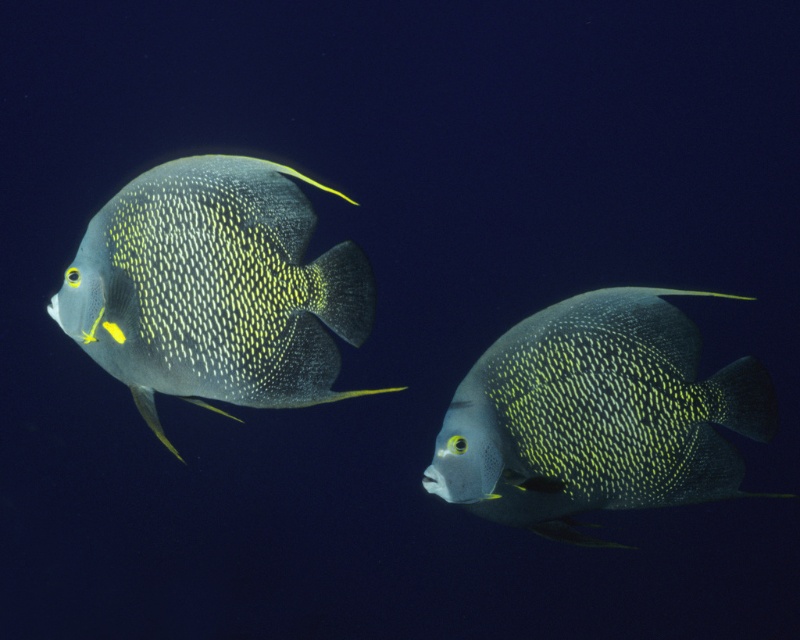
You are a marine biologist observing two fish in the ocean. You see a shiny blue fish at left and a shiny blue fish at right. Which fish is closer to the point at coordinates (216, 289)?

The shiny blue fish at left is located at point (216, 289), so it is exactly at that coordinate point.

You are an underwater photographer aiming to capture both the shiny blue fish at left and the shiny blue fish at center in a single frame. Given their sizes, which fish should you focus on to ensure both fit clearly in your shot?

The shiny blue fish at left is larger than the shiny blue fish at center. To ensure both fit clearly in the frame, focus on the shiny blue fish at left first, as accommodating its larger size will naturally allow the smaller fish at center to fit within the shot.